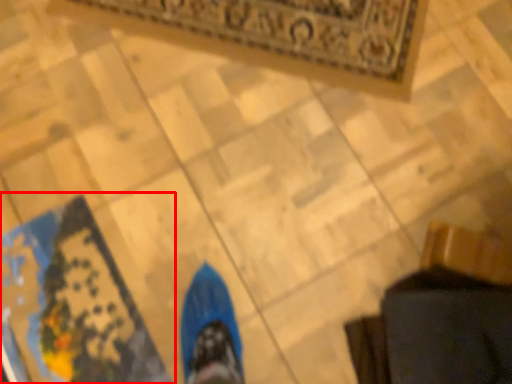
Question: From the image's perspective, what is the correct spatial relationship of mat (annotated by the red box) in relation to mat?

Choices:
 (A) below
 (B) above

Answer: (A)